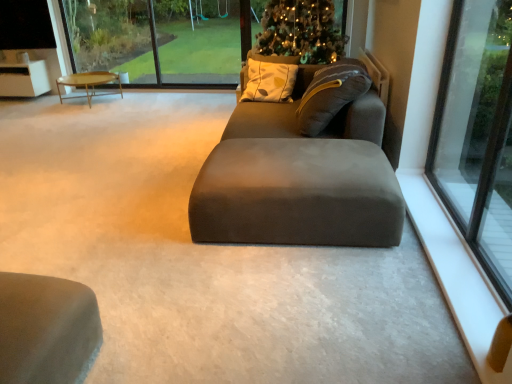
Where is `free space in front of suede-like gray studio couch at center`? The image size is (512, 384). free space in front of suede-like gray studio couch at center is located at coordinates (293, 299).